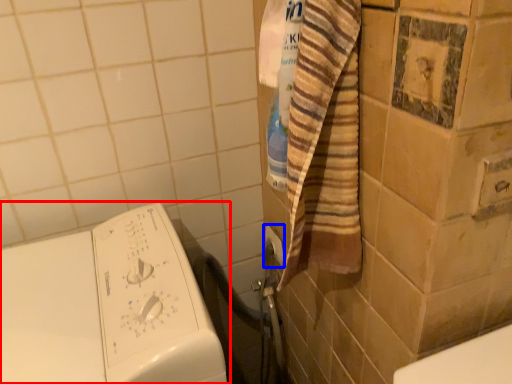
Question: Which object is further to the camera taking this photo, washing machine (highlighted by a red box) or electric outlet (highlighted by a blue box)?

Choices:
 (A) washing machine
 (B) electric outlet

Answer: (B)